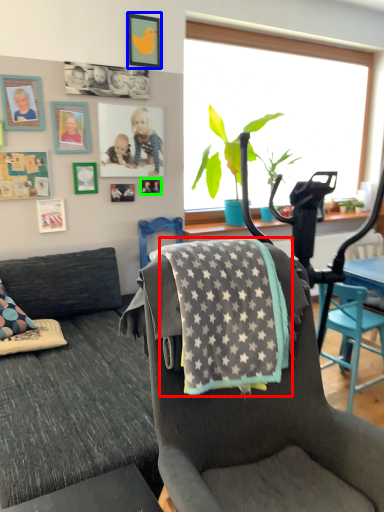
Question: Which is farther away from blanket (highlighted by a red box)? picture frame (highlighted by a blue box) or picture frame (highlighted by a green box)?

Choices:
 (A) picture frame
 (B) picture frame

Answer: (A)